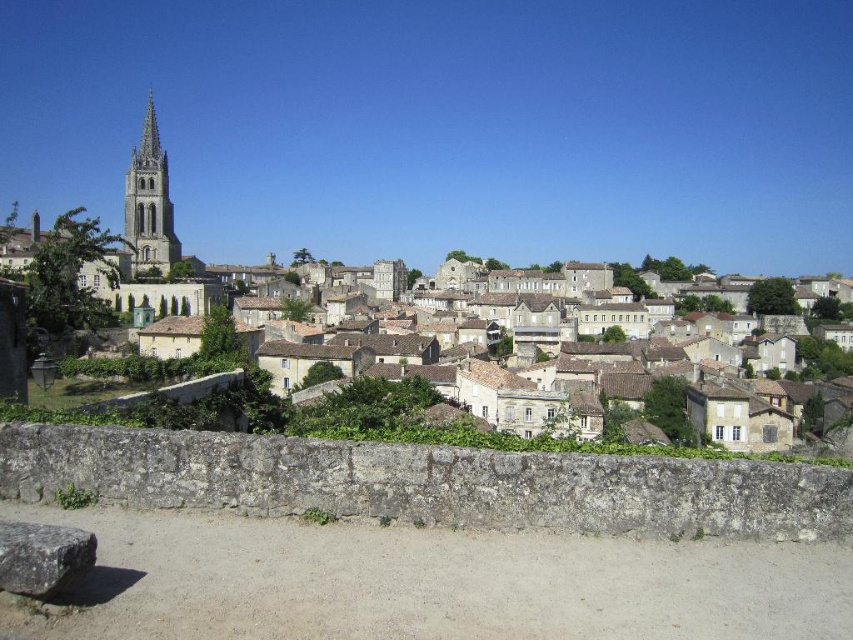
Who is lower down, stone houses at center or smooth stone tower at upper left?

Positioned lower is stone houses at center.

Which of these two, stone houses at center or smooth stone tower at upper left, stands shorter?

Standing shorter between the two is stone houses at center.

Between point (851, 362) and point (131, 163), which one is positioned in front?

Point (851, 362) is more forward.

This screenshot has height=640, width=853. I want to click on stone houses at center, so click(494, 300).